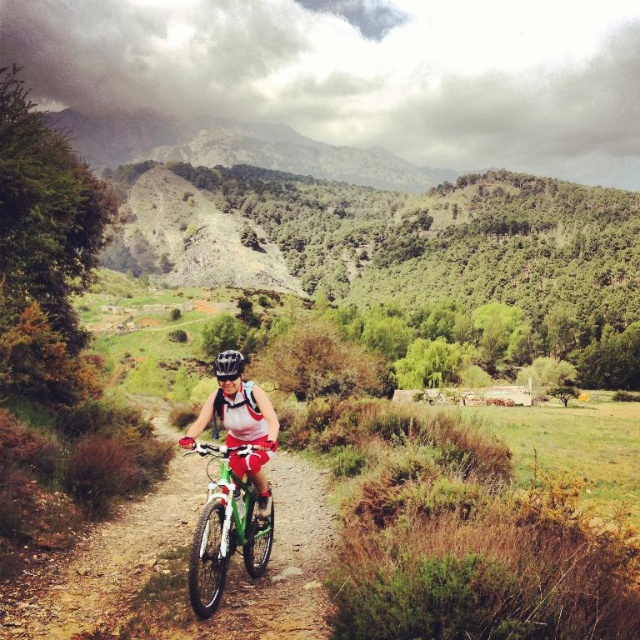
Who is more forward, (248,502) or (237,397)?

Point (248,502) is in front.

Which is more to the left, green matte bicycle at center or matte white helmet at center?

green matte bicycle at center is more to the left.

Does point (221, 557) lie in front of point (236, 388)?

Yes.

Where is `green matte bicycle at center`? Image resolution: width=640 pixels, height=640 pixels. green matte bicycle at center is located at coordinates (225, 529).

Is green matte bicycle at center smaller than black matte bicycle helmet at center?

Indeed, green matte bicycle at center has a smaller size compared to black matte bicycle helmet at center.

Does point (216, 596) come behind point (230, 371)?

No, it is in front of (230, 371).

Measure the distance between point (237, 536) and camera.

A distance of 18.09 meters exists between point (237, 536) and camera.

Image resolution: width=640 pixels, height=640 pixels. What are the coordinates of `green matte bicycle at center` in the screenshot? It's located at (225, 529).

Does matte white helmet at center have a greater height compared to black matte bicycle helmet at center?

Incorrect, matte white helmet at center's height is not larger of black matte bicycle helmet at center's.

Who is taller, matte white helmet at center or black matte bicycle helmet at center?

With more height is black matte bicycle helmet at center.

Image resolution: width=640 pixels, height=640 pixels. What do you see at coordinates (241, 432) in the screenshot?
I see `matte white helmet at center` at bounding box center [241, 432].

The width and height of the screenshot is (640, 640). Find the location of `matte white helmet at center`. matte white helmet at center is located at coordinates (241, 432).